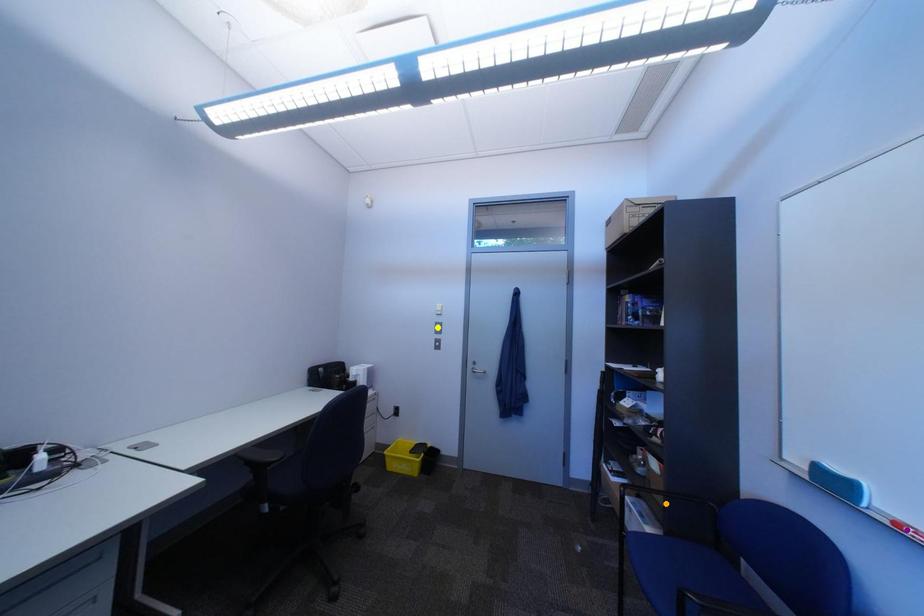
Order these from farthest to nearest:
purple point, yellow point, orange point

yellow point
orange point
purple point